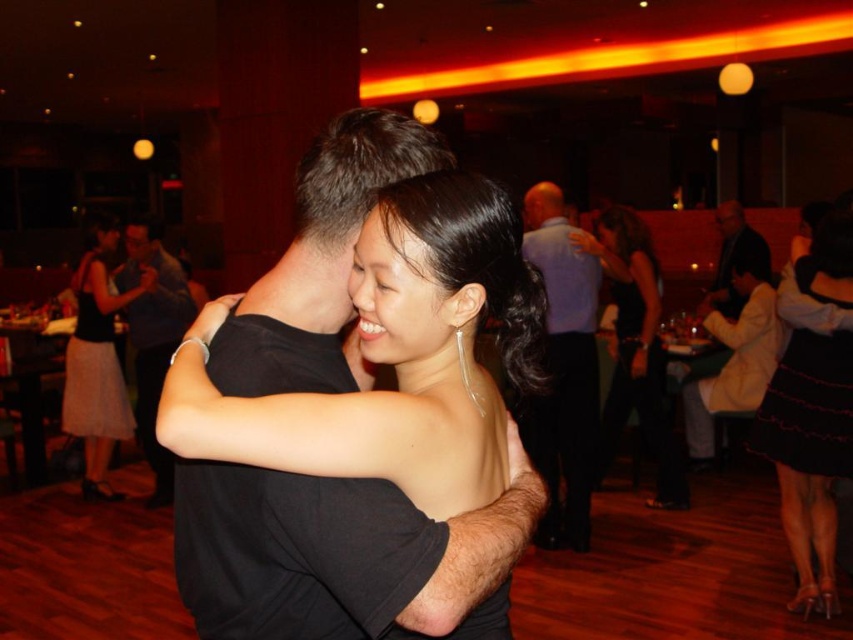
From the picture: You are a photographer at a party and want to capture a photo of the light blue shirt at upper right and dark gray suit at right. If you want to ensure both subjects are in focus, which one should you focus on first considering their heights?

The light blue shirt at upper right is taller than the dark gray suit at right. To ensure both are in focus, focus on the light blue shirt at upper right first since it is taller, allowing the depth of field to cover the shorter subject.

You are at a party and want to take a photo of the black matte shirt at center and the dark gray suit at right. Since the camera can only focus on one subject at a time, which one should you focus on first to ensure the other is still in the frame?

You should focus on the dark gray suit at right first because the black matte shirt at center is positioned under it, so keeping the dark gray suit in focus will naturally include the black matte shirt in the frame as well.

In the scene shown: You are a photographer at the event and need to capture a photo of both the satin black dress at center and the black satin dress at center. Since you want to ensure both dresses are fully visible in the frame, which dress requires more space horizontally?

The black satin dress at center requires more space horizontally because its width is greater than the satin black dress at center.